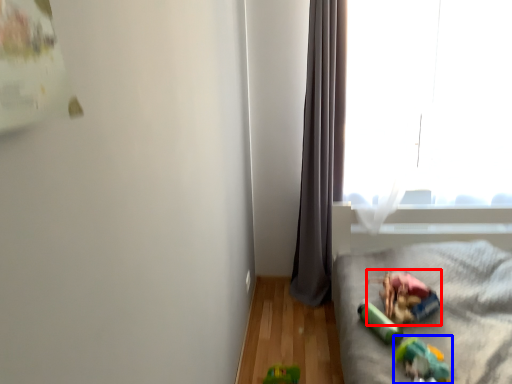
Question: Which of the following is the farthest to the observer, stuff (highlighted by a red box) or toy (highlighted by a blue box)?

Choices:
 (A) stuff
 (B) toy

Answer: (A)